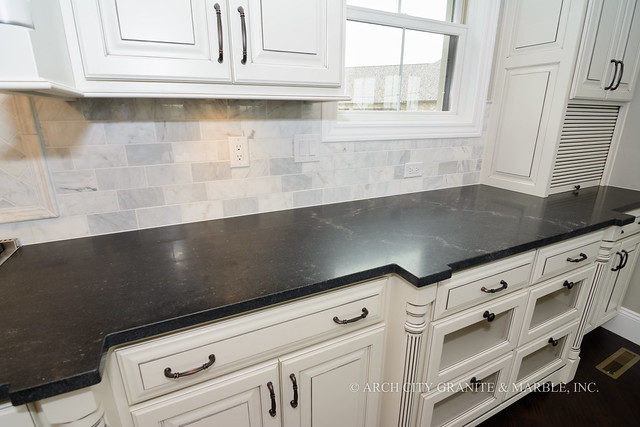
I want to click on window, so click(x=381, y=38).